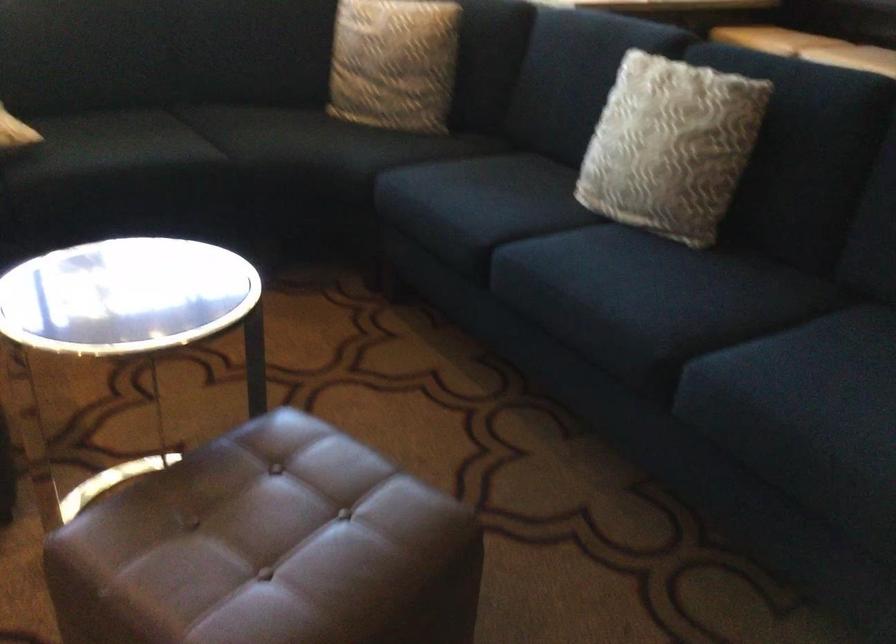
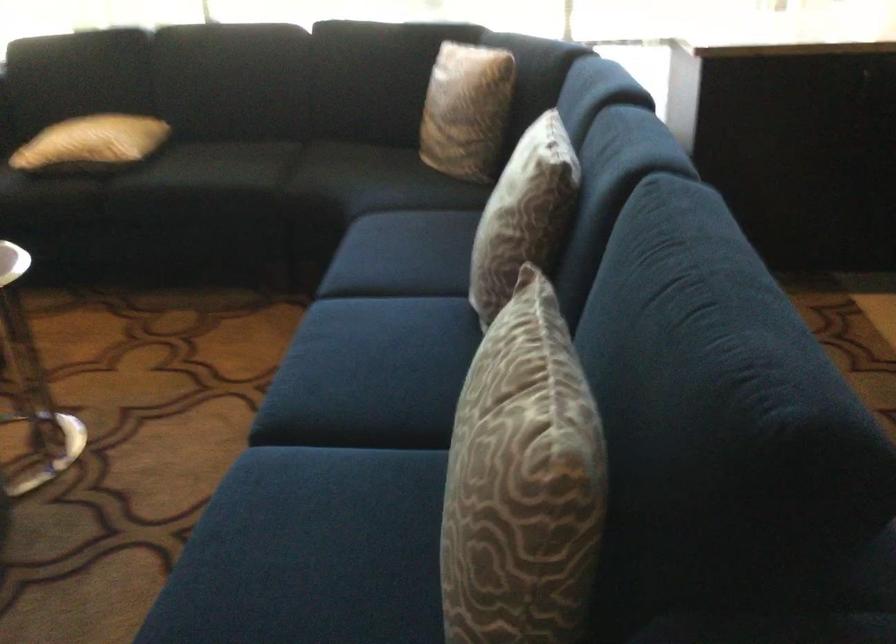
The point at (717, 134) is marked in the first image. Where is the corresponding point in the second image?

(523, 213)